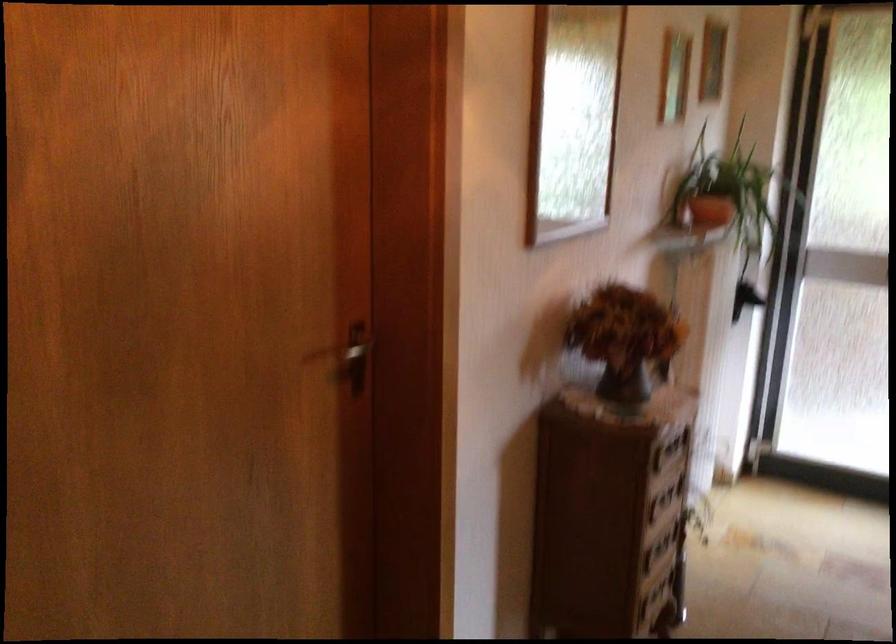
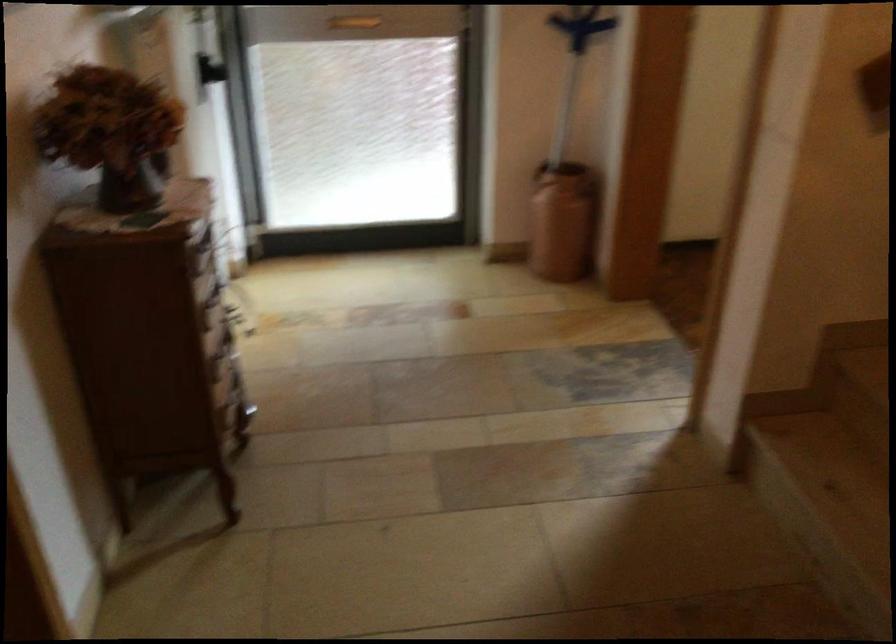
How did the camera likely rotate?

The camera's rotation is toward right-down.